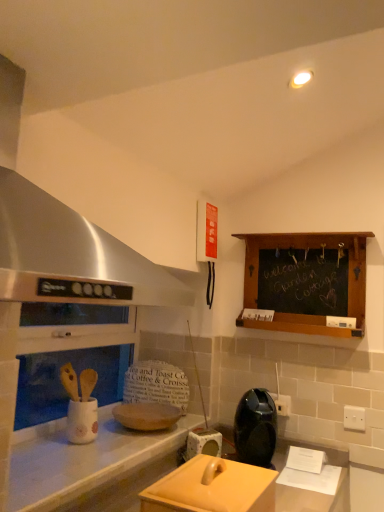
Locate an element on the screen. The height and width of the screenshot is (512, 384). free space above stainless steel exhaust hood at upper left (from a real-world perspective) is located at coordinates (76, 54).